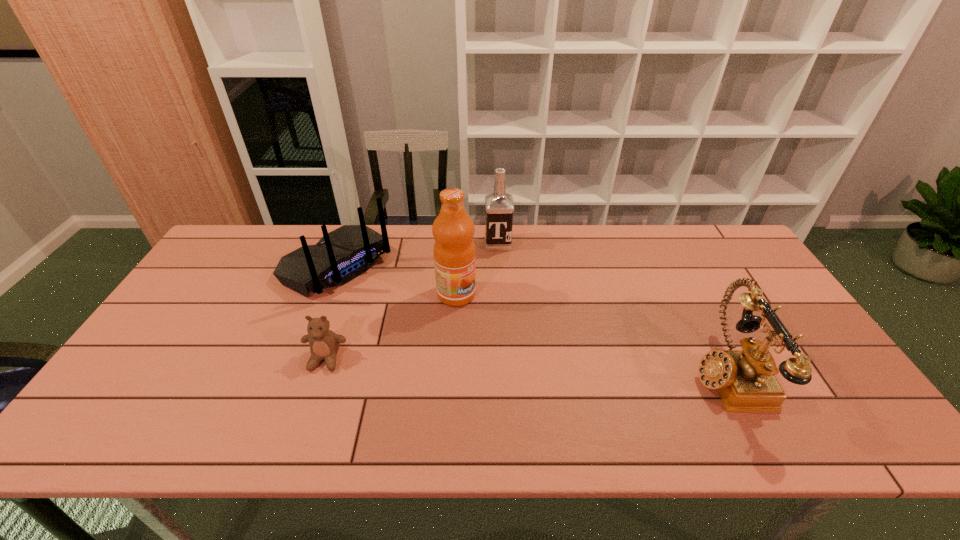
What are the coordinates of `free spot that satisfies the following two spatial constraints: 1. on the front side of the second object from right to left; 2. on the dial number of the rightmost object` in the screenshot? It's located at (505, 372).